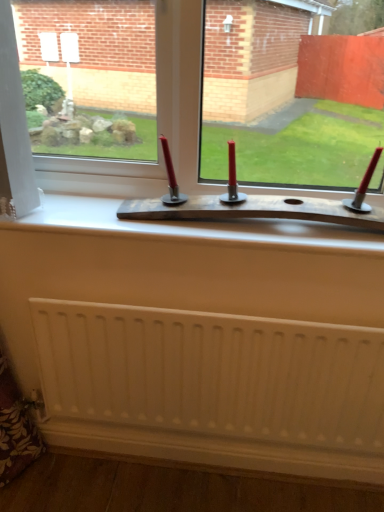
Question: Is white matte radiator at lower center thinner than wooden board at center?

Choices:
 (A) yes
 (B) no

Answer: (A)

Question: Can we say white matte radiator at lower center lies outside wooden board at center?

Choices:
 (A) no
 (B) yes

Answer: (B)

Question: Is white matte radiator at lower center bigger than wooden board at center?

Choices:
 (A) yes
 (B) no

Answer: (B)

Question: Does white matte radiator at lower center have a greater width compared to wooden board at center?

Choices:
 (A) no
 (B) yes

Answer: (A)

Question: From the image's perspective, is white matte radiator at lower center located beneath wooden board at center?

Choices:
 (A) yes
 (B) no

Answer: (A)

Question: Does white matte radiator at lower center lie behind wooden board at center?

Choices:
 (A) yes
 (B) no

Answer: (A)

Question: Is wooden board at center turned away from white matte radiator at lower center?

Choices:
 (A) yes
 (B) no

Answer: (B)

Question: From the image's perspective, would you say wooden board at center is positioned over white matte radiator at lower center?

Choices:
 (A) yes
 (B) no

Answer: (A)

Question: Is white matte radiator at lower center completely or partially inside wooden board at center?

Choices:
 (A) no
 (B) yes

Answer: (A)

Question: Would you say wooden board at center is a long distance from white matte radiator at lower center?

Choices:
 (A) no
 (B) yes

Answer: (A)

Question: Does wooden board at center have a lesser width compared to white matte radiator at lower center?

Choices:
 (A) yes
 (B) no

Answer: (B)

Question: From a real-world perspective, is wooden board at center on white matte radiator at lower center?

Choices:
 (A) no
 (B) yes

Answer: (B)

Question: From a real-world perspective, relative to white matte radiator at lower center, is wooden board at center vertically above or below?

Choices:
 (A) below
 (B) above

Answer: (B)